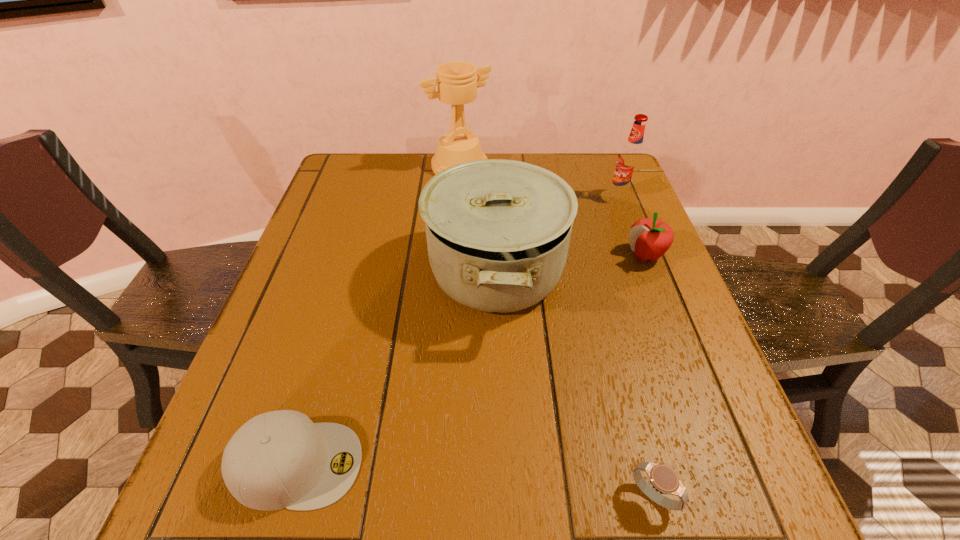
Image resolution: width=960 pixels, height=540 pixels. In order to click on vacant area at the far left corner of the desktop in this screenshot , I will do `click(367, 158)`.

In order to click on vacant space at the far right corner of the desktop in this screenshot , I will do `click(590, 194)`.

Find the location of a particular element. The image size is (960, 540). free spot between the cap and the apple is located at coordinates (470, 360).

Identify the location of free space between the award and the watch. (556, 331).

This screenshot has height=540, width=960. I want to click on vacant region between the leftmost object and the fourth object from left to right, so click(474, 480).

The image size is (960, 540). What are the coordinates of `vacant space that is in between the third object from right to left and the cap` in the screenshot? It's located at (474, 480).

What are the coordinates of `free space between the fourth tallest object and the saucepan` in the screenshot? It's located at (570, 264).

The height and width of the screenshot is (540, 960). Identify the location of free area in between the third shortest object and the shortest object. (648, 376).

The image size is (960, 540). Identify the location of vacant region between the fifth nearest object and the watch. (636, 347).

I want to click on the fifth closest object to the saucepan, so click(x=663, y=478).